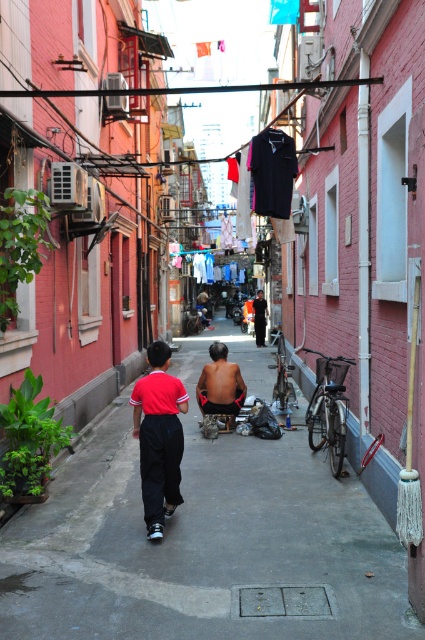
Question: Is smooth concrete pavement at center below dark gray fabric jacket at center?

Choices:
 (A) no
 (B) yes

Answer: (B)

Question: Is smooth concrete pavement at center closer to the viewer compared to matte red shirt at center?

Choices:
 (A) no
 (B) yes

Answer: (B)

Question: Which object appears farthest from the camera in this image?

Choices:
 (A) dark gray fabric jacket at center
 (B) smooth concrete pavement at center
 (C) matte red shirt at center

Answer: (A)

Question: Which object is closer to the camera taking this photo?

Choices:
 (A) dark gray fabric jacket at center
 (B) matte red shirt at center
 (C) skinny man at center

Answer: (B)

Question: Which of the following is the farthest from the observer?

Choices:
 (A) smooth concrete pavement at center
 (B) dark gray fabric jacket at center
 (C) skinny man at center
 (D) matte red shirt at center

Answer: (B)

Question: Does matte red shirt at center come behind dark gray fabric jacket at center?

Choices:
 (A) no
 (B) yes

Answer: (A)